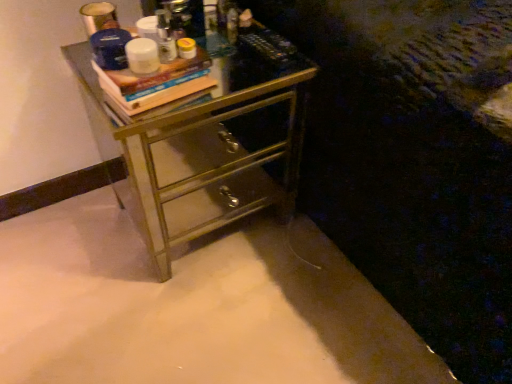
What do you see at coordinates (156, 83) in the screenshot? I see `wooden book at upper center` at bounding box center [156, 83].

Image resolution: width=512 pixels, height=384 pixels. I want to click on wooden book at upper center, so click(156, 83).

The image size is (512, 384). I want to click on metallic gold chest of drawers at center, so (x=198, y=139).

Describe the element at coordinates (198, 139) in the screenshot. This screenshot has height=384, width=512. I see `metallic gold chest of drawers at center` at that location.

At what (x,y) coordinates should I click in order to perform the action: click on wooden book at upper center. Please return your answer as a coordinate pair (x, y). This screenshot has width=512, height=384. Looking at the image, I should click on (156, 83).

Would you say metallic gold chest of drawers at center is to the left or to the right of wooden book at upper center in the picture?

metallic gold chest of drawers at center is positioned on wooden book at upper center's right side.

In the scene shown: Is the position of metallic gold chest of drawers at center less distant than that of wooden book at upper center?

No, metallic gold chest of drawers at center is further to the viewer.

Considering the positions of points (145, 206) and (203, 61), is point (145, 206) closer to camera compared to point (203, 61)?

That is False.

From the image's perspective, between metallic gold chest of drawers at center and wooden book at upper center, which one is located above?

wooden book at upper center.

From a real-world perspective, who is located higher, metallic gold chest of drawers at center or wooden book at upper center?

In real-world perspective, wooden book at upper center is above.

Is metallic gold chest of drawers at center wider than wooden book at upper center?

Indeed, metallic gold chest of drawers at center has a greater width compared to wooden book at upper center.

Considering the sizes of objects metallic gold chest of drawers at center and wooden book at upper center in the image provided, who is taller, metallic gold chest of drawers at center or wooden book at upper center?

Standing taller between the two is metallic gold chest of drawers at center.

Considering the relative sizes of metallic gold chest of drawers at center and wooden book at upper center in the image provided, is metallic gold chest of drawers at center bigger than wooden book at upper center?

Correct, metallic gold chest of drawers at center is larger in size than wooden book at upper center.

Is wooden book at upper center inside metallic gold chest of drawers at center?

Actually, wooden book at upper center is outside metallic gold chest of drawers at center.

Is metallic gold chest of drawers at center next to wooden book at upper center and touching it?

No, metallic gold chest of drawers at center is not making contact with wooden book at upper center.

Is metallic gold chest of drawers at center turned away from wooden book at upper center?

No, metallic gold chest of drawers at center is not facing the opposite direction of wooden book at upper center.

What's the angular difference between metallic gold chest of drawers at center and wooden book at upper center's facing directions?

The angular difference between metallic gold chest of drawers at center and wooden book at upper center is 8.24 degrees.

The image size is (512, 384). Find the location of `chest of drawers behind the wooden book at upper center`. chest of drawers behind the wooden book at upper center is located at coordinates (198, 139).

Considering the positions of objects wooden book at upper center and metallic gold chest of drawers at center in the image provided, who is more to the right, wooden book at upper center or metallic gold chest of drawers at center?

metallic gold chest of drawers at center is more to the right.

Considering their positions, is wooden book at upper center located in front of or behind metallic gold chest of drawers at center?

Clearly, wooden book at upper center is in front of metallic gold chest of drawers at center.

Is point (131, 77) positioned behind point (142, 114)?

No, (131, 77) is closer to viewer.

From the image's perspective, is wooden book at upper center under metallic gold chest of drawers at center?

No.

From a real-world perspective, is wooden book at upper center above or below metallic gold chest of drawers at center?

In terms of real-world spatial position, wooden book at upper center is above metallic gold chest of drawers at center.

Does wooden book at upper center have a lesser width compared to metallic gold chest of drawers at center?

Correct, the width of wooden book at upper center is less than that of metallic gold chest of drawers at center.

Who is shorter, wooden book at upper center or metallic gold chest of drawers at center?

With less height is wooden book at upper center.

From the picture: Based on their sizes in the image, would you say wooden book at upper center is bigger or smaller than metallic gold chest of drawers at center?

wooden book at upper center is smaller than metallic gold chest of drawers at center.

Is wooden book at upper center surrounding metallic gold chest of drawers at center?

No, metallic gold chest of drawers at center is located outside of wooden book at upper center.

Looking at this image, are wooden book at upper center and metallic gold chest of drawers at center located far from each other?

wooden book at upper center is near metallic gold chest of drawers at center, not far away.

Is wooden book at upper center oriented towards metallic gold chest of drawers at center?

No, wooden book at upper center is not aimed at metallic gold chest of drawers at center.

Where is `book above the metallic gold chest of drawers at center (from the image's perspective)`? This screenshot has width=512, height=384. book above the metallic gold chest of drawers at center (from the image's perspective) is located at coordinates (156, 83).

At what (x,y) coordinates should I click in order to perform the action: click on book in front of the metallic gold chest of drawers at center. Please return your answer as a coordinate pair (x, y). This screenshot has width=512, height=384. Looking at the image, I should click on pos(156,83).

Where is `the chest of drawers that is under the wooden book at upper center (from a real-world perspective)`? The width and height of the screenshot is (512, 384). the chest of drawers that is under the wooden book at upper center (from a real-world perspective) is located at coordinates (198, 139).